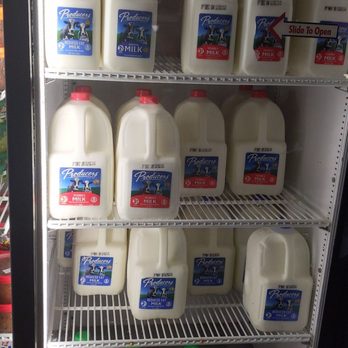
The height and width of the screenshot is (348, 348). Find the location of `handle`. handle is located at coordinates (81, 137), (147, 144), (204, 131), (265, 123), (291, 261), (213, 239), (161, 255), (100, 235).